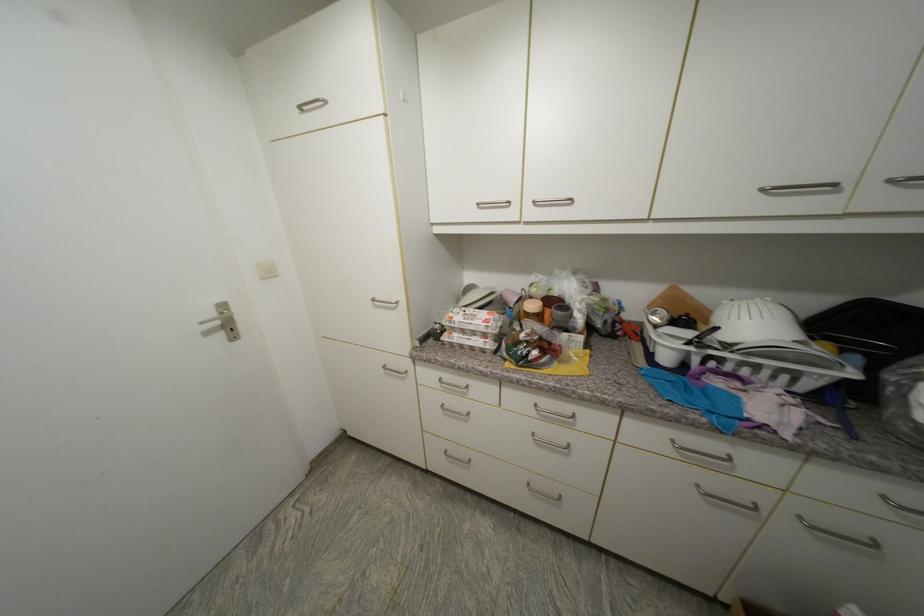
Find where to lift the white colander. Please return your answer as a coordinate pair (x, y).

(755, 322)